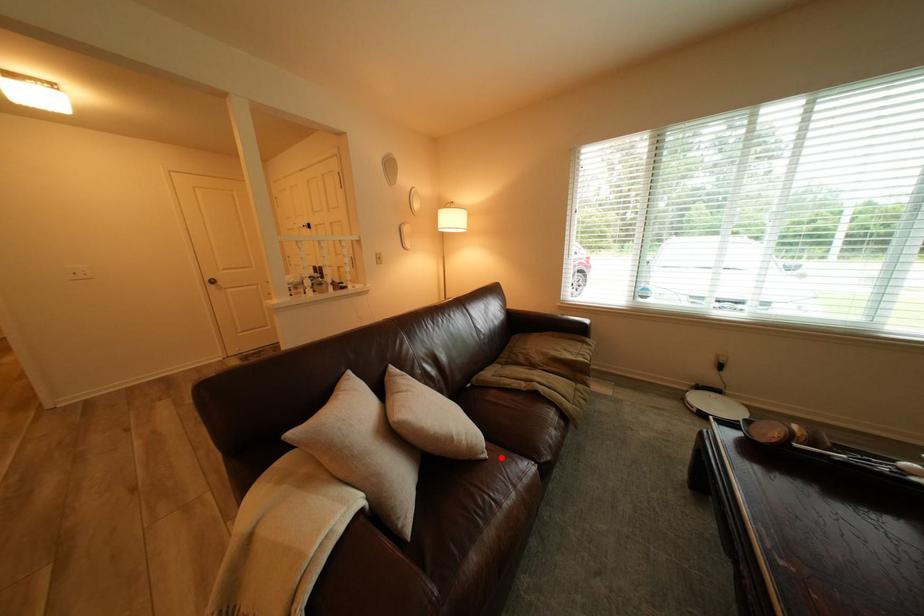
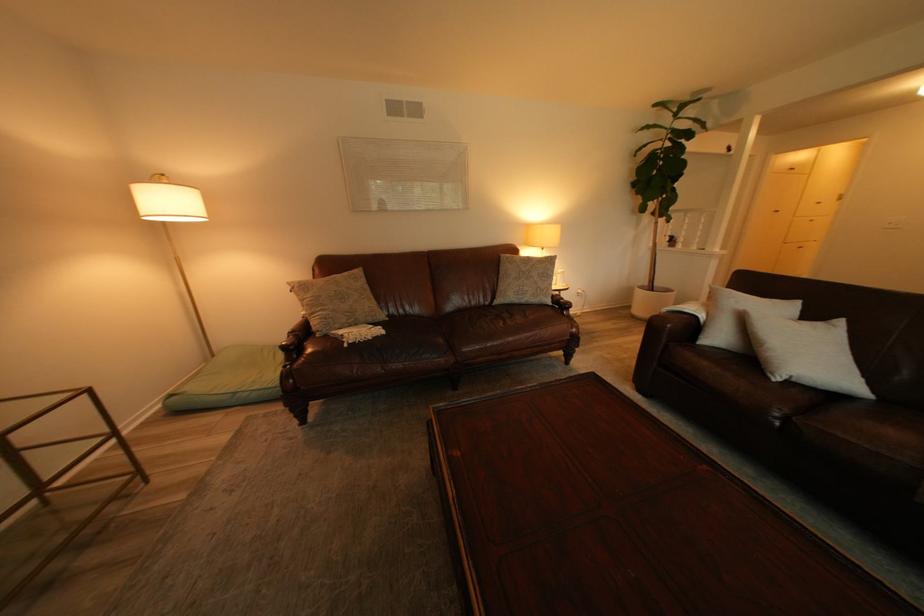
In the second image, find the point that corresponds to the highlighted location in the first image.

(787, 381)